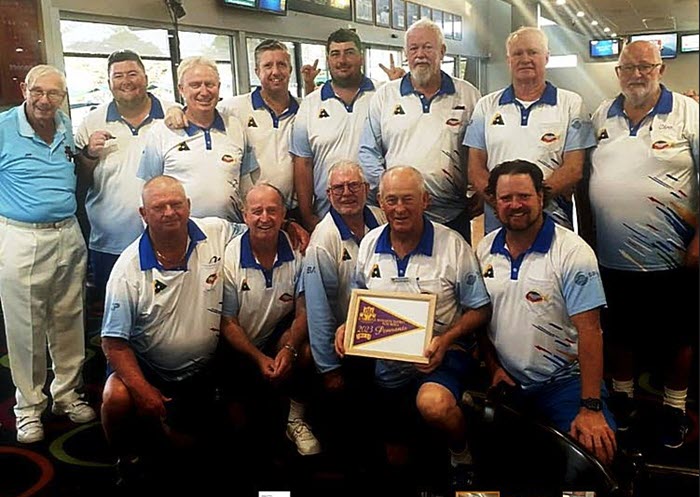
Find the location of a particular element. Image resolution: width=700 pixels, height=497 pixels. plaque is located at coordinates (390, 343).